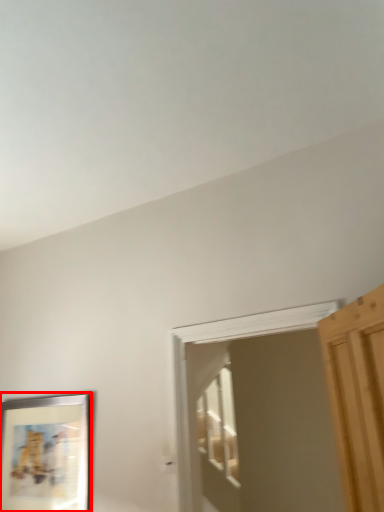
Question: Where is picture frame (annotated by the red box) located in relation to screen door in the image?

Choices:
 (A) right
 (B) left

Answer: (B)